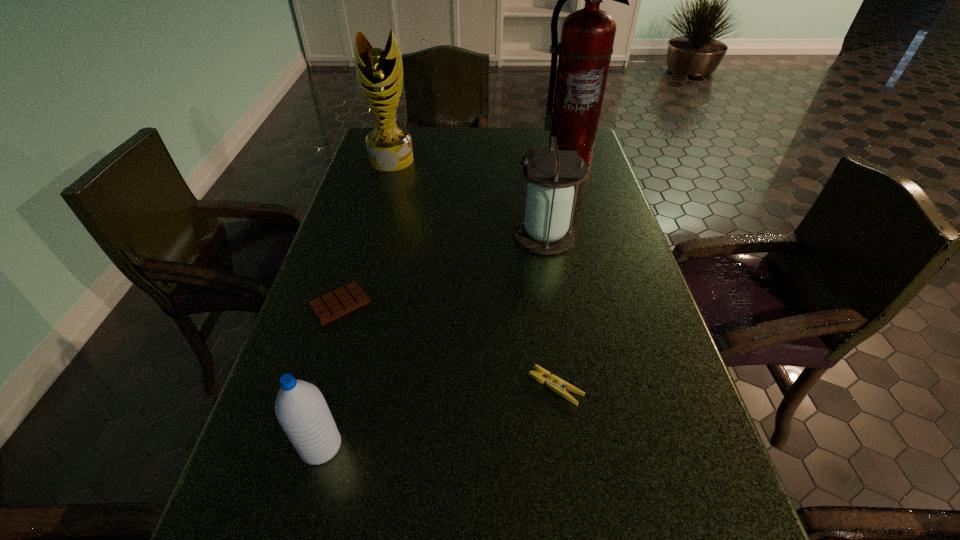
The height and width of the screenshot is (540, 960). What are the coordinates of `fire extinguisher` in the screenshot? It's located at (587, 38).

Image resolution: width=960 pixels, height=540 pixels. Identify the location of award. (379, 72).

Locate an element on the screen. The image size is (960, 540). the fourth shortest object is located at coordinates (546, 229).

You are a GUI agent. You are given a task and a screenshot of the screen. Output one action in this format:
    pyautogui.click(x=<x>, y=<y>)
    Task: Click on the lantern
    
    Given the screenshot: What is the action you would take?
    pyautogui.click(x=546, y=229)

Where is `the third shortest object`? The height and width of the screenshot is (540, 960). the third shortest object is located at coordinates (301, 409).

You are a GUI agent. You are given a task and a screenshot of the screen. Output one action in this format:
    pyautogui.click(x=<x>, y=<y>)
    Task: Click on the water bottle
    
    Given the screenshot: What is the action you would take?
    pyautogui.click(x=301, y=409)

The image size is (960, 540). In order to click on candy bar in this screenshot , I will do `click(343, 300)`.

Where is `the second nearest object`? the second nearest object is located at coordinates (553, 382).

You are a GUI agent. You are given a task and a screenshot of the screen. Output one action in this format:
    pyautogui.click(x=<x>, y=<y>)
    Task: Click on the free region located 0.100m on the side of the fire extinguisher with the handle and hose
    
    Given the screenshot: What is the action you would take?
    pyautogui.click(x=577, y=187)

I want to click on free region located 0.120m on the front-facing side of the fifth shortest object, so click(x=382, y=193).